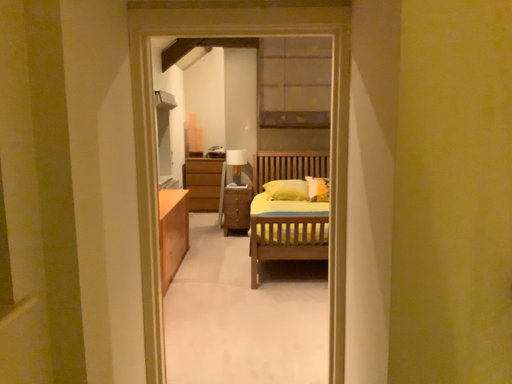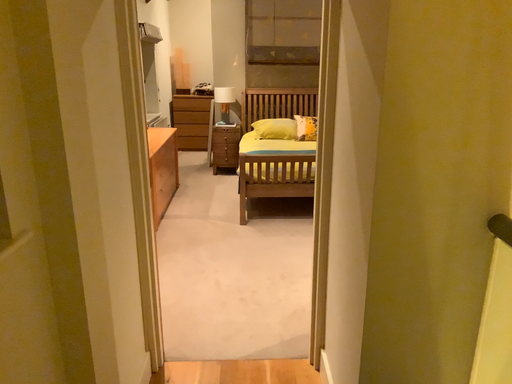
Question: How did the camera likely rotate when shooting the video?

Choices:
 (A) rotated upward
 (B) rotated downward

Answer: (B)